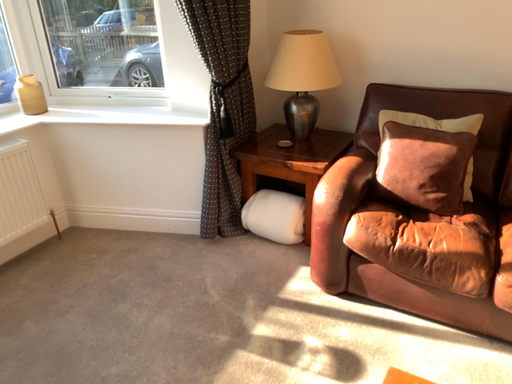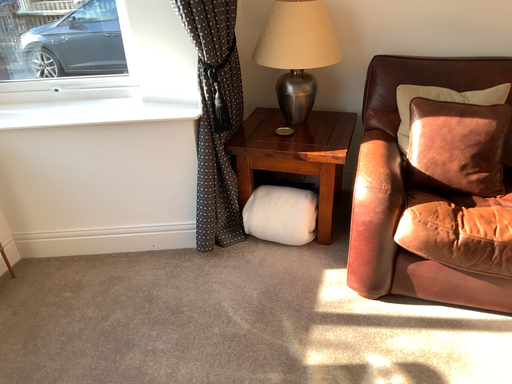
Question: Which way did the camera rotate in the video?

Choices:
 (A) rotated right
 (B) rotated left

Answer: (A)